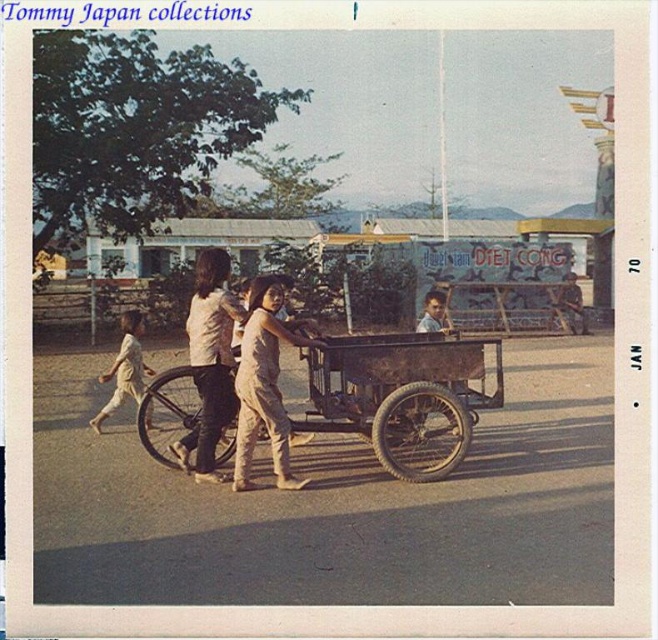
Question: Is light beige cotton pants at center positioned at the back of smooth skin boy at center?

Choices:
 (A) no
 (B) yes

Answer: (B)

Question: Which point is closer to the camera?

Choices:
 (A) light beige cotton pants at center
 (B) smooth skin boy at center
 (C) light beige fabric shirt at center
 (D) light beige fabric dress at center

Answer: (D)

Question: Is light beige fabric dress at center wider than smooth skin boy at center?

Choices:
 (A) no
 (B) yes

Answer: (A)

Question: Which object appears farthest from the camera in this image?

Choices:
 (A) smooth skin boy at center
 (B) light beige cotton pants at center
 (C) light beige fabric dress at center

Answer: (B)

Question: Does light beige cotton pants at center have a lesser width compared to smooth skin boy at center?

Choices:
 (A) no
 (B) yes

Answer: (B)

Question: Which of the following is the farthest from the observer?

Choices:
 (A) light beige fabric shirt at center
 (B) brown wooden wagon at center
 (C) light beige cotton pants at center
 (D) light beige fabric dress at center

Answer: (C)